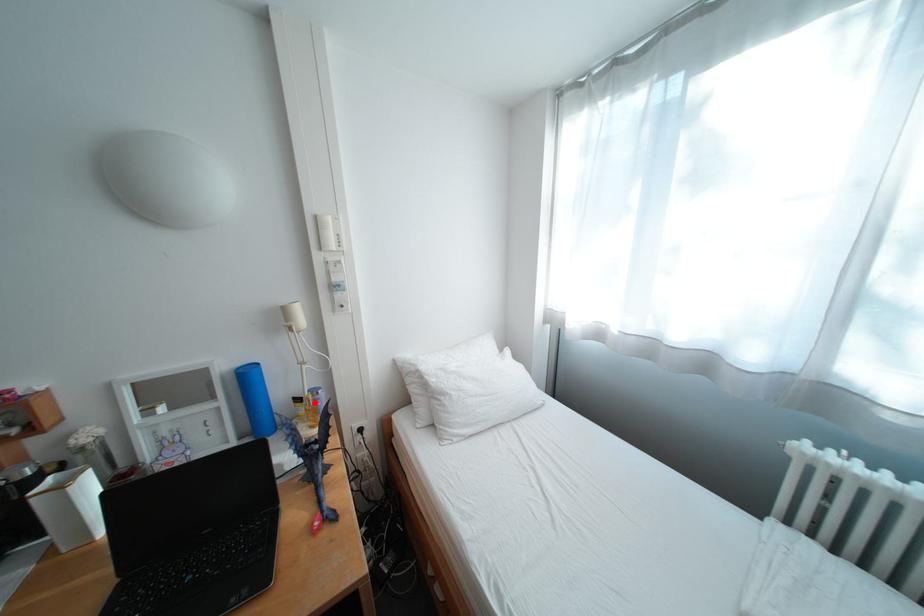
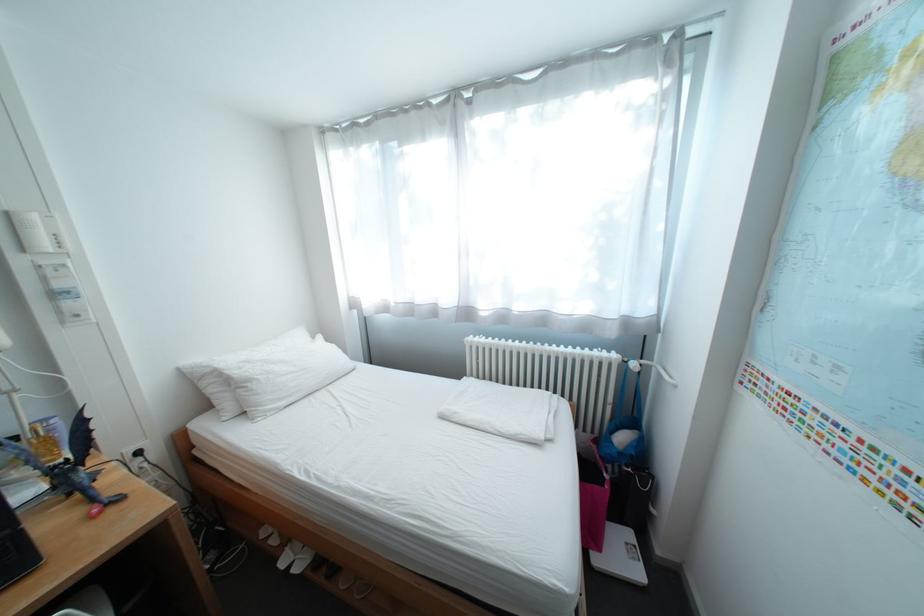
Find the pixel in the second image that matches the highlighted location in the first image.

(31, 440)